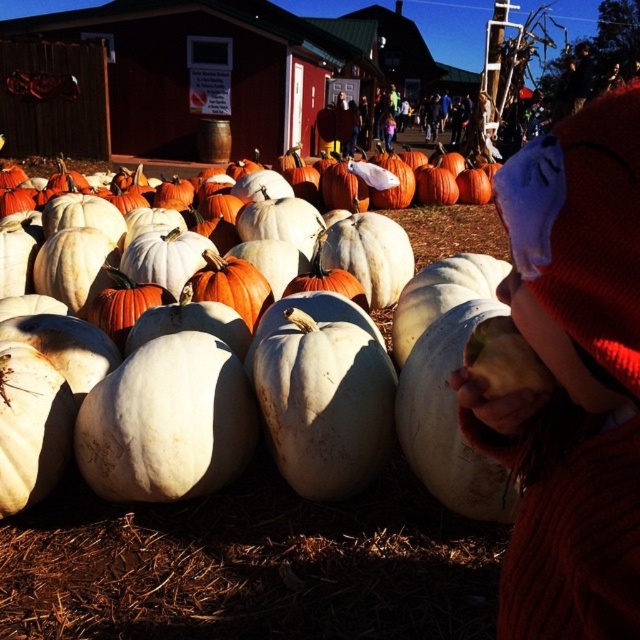
You are standing at the entrance of the red building with a green roof and want to walk to the pumpkin patch. Which point, point (577, 326) or point (202, 241), is closer to you as you face the pumpkin patch?

Point (577, 326) is closer to you because it is in front of point (202, 241).

You are a customer at the pumpkin patch and see the red knit sweater at right and the white matte pumpkin at center. Which object is closer to you?

The red knit sweater at right is closer to you because it is positioned under the white matte pumpkin at center, meaning it is in a lower spatial plane and thus nearer to the viewer.